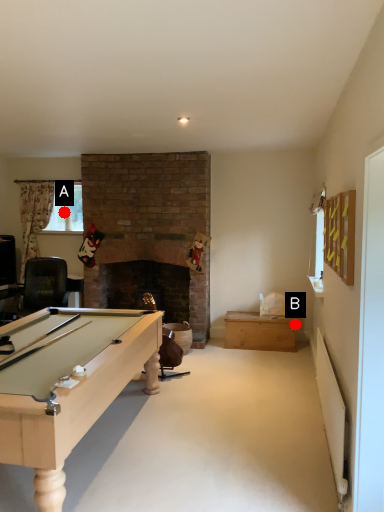
Question: Two points are circled on the image, labeled by A and B beside each circle. Which point is further to the camera?

Choices:
 (A) A is further
 (B) B is further

Answer: (A)